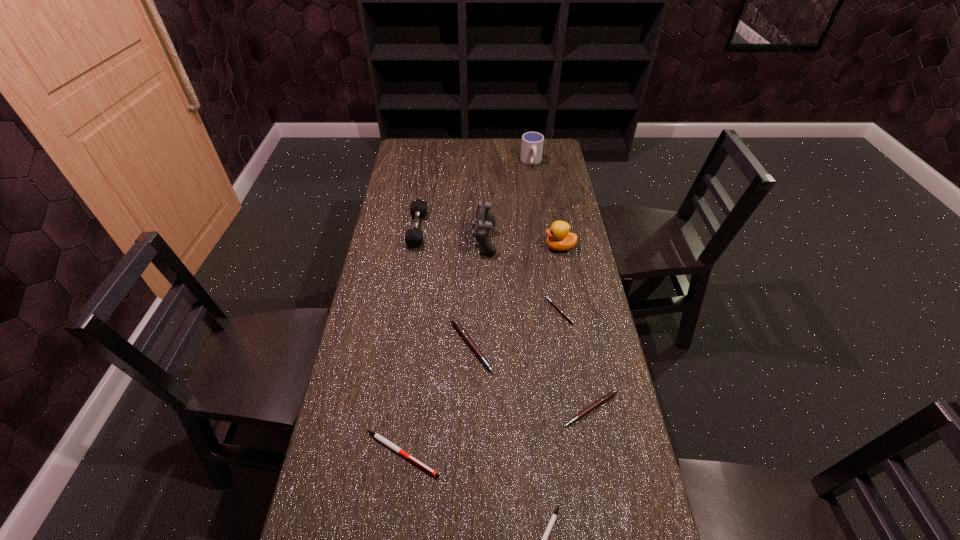
Where is `the smallest pink pen`? Image resolution: width=960 pixels, height=540 pixels. the smallest pink pen is located at coordinates pos(553,303).

The image size is (960, 540). In order to click on vacant space located on the surface of the control with buttons in this screenshot , I will do `click(459, 239)`.

Find the location of a particular element. The image size is (960, 540). vacant space located 0.220m on the surface of the control with buttons is located at coordinates (413, 239).

Image resolution: width=960 pixels, height=540 pixels. What are the coordinates of `vacant space situated on the surface of the control with buttons` in the screenshot? It's located at tap(402, 239).

This screenshot has width=960, height=540. What are the coordinates of `free space located with the handle on the side of the farthest object` in the screenshot? It's located at (535, 185).

Locate an element on the screen. This screenshot has width=960, height=540. free point located 0.050m on the face of the duckling is located at coordinates (530, 247).

The image size is (960, 540). Identify the location of vacant region located 0.140m on the face of the duckling. [x=505, y=247].

Identify the location of free space located on the face of the duckling. This screenshot has height=540, width=960. pos(508,247).

Identify the location of vacant space located 0.320m on the front of the dumbbell. (404, 319).

The image size is (960, 540). I want to click on vacant region located 0.140m at the nib of the fifth shortest object, so click(x=540, y=346).